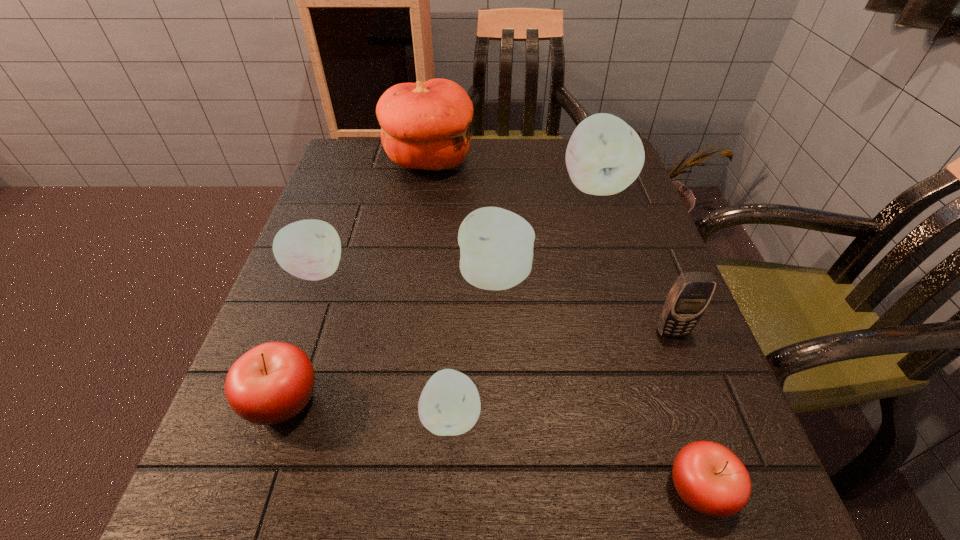
Where is `free space that is in between the farthest apple and the farther red apple`? free space that is in between the farthest apple and the farther red apple is located at coordinates [x=440, y=293].

I want to click on object that is the closest to the pumpkin, so click(604, 155).

Select which object appears as the second closest to the third smallest white apple. Please provide its 2D coordinates. Your answer should be formatted as a tuple, i.e. [(x, y)], where the tuple contains the x and y coordinates of a point satisfying the conditions above.

[(604, 155)]

Locate an element on the screen. This screenshot has height=540, width=960. apple that stands as the closest to the nearest white apple is located at coordinates (271, 383).

Choose which apple is the sixth nearest neighbor to the fourth nearest object. Please provide its 2D coordinates. Your answer should be formatted as a tuple, i.e. [(x, y)], where the tuple contains the x and y coordinates of a point satisfying the conditions above.

[(310, 249)]

Find the location of a particular element. The image size is (960, 540). white apple that is the closest one to the cellular telephone is located at coordinates (496, 245).

Identify which white apple is located as the third nearest to the third biggest white apple. Please provide its 2D coordinates. Your answer should be formatted as a tuple, i.e. [(x, y)], where the tuple contains the x and y coordinates of a point satisfying the conditions above.

[(604, 155)]

Locate an element on the screen. Image resolution: width=960 pixels, height=540 pixels. free spot that satisfies the following two spatial constraints: 1. on the back side of the farthest white apple; 2. on the left side of the second smallest white apple is located at coordinates (347, 186).

Find the location of a particular element. vacant region that satisfies the following two spatial constraints: 1. on the front side of the smallest white apple; 2. on the left side of the second smallest white apple is located at coordinates (263, 416).